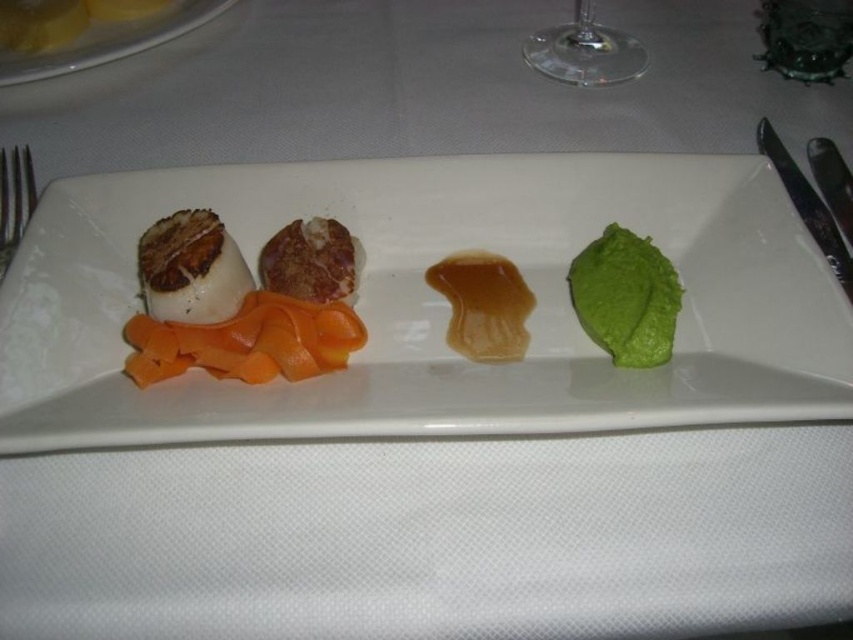
Does point (171, 20) come farther from viewer compared to point (543, 38)?

Yes, point (171, 20) is farther from viewer.

This screenshot has width=853, height=640. What do you see at coordinates (109, 42) in the screenshot?
I see `yellow matte plate at upper left` at bounding box center [109, 42].

Find the location of a particular element. This screenshot has width=853, height=640. yellow matte plate at upper left is located at coordinates (109, 42).

This screenshot has height=640, width=853. Describe the element at coordinates (584, 51) in the screenshot. I see `transparent glass wine glass at upper center` at that location.

Is transparent glass wine glass at upper center to the right of silvermetallicutensil at right from the viewer's perspective?

No, transparent glass wine glass at upper center is not to the right of silvermetallicutensil at right.

Between point (614, 74) and point (814, 240), which one is positioned behind?

Point (614, 74)

At what (x,y) coordinates should I click in order to perform the action: click on transparent glass wine glass at upper center. Please return your answer as a coordinate pair (x, y). The width and height of the screenshot is (853, 640). Looking at the image, I should click on (584, 51).

This screenshot has width=853, height=640. Describe the element at coordinates (311, 260) in the screenshot. I see `brown crispy meat at center` at that location.

In the scene shown: Which is more to the right, brown crispy meat at center or yellow matte plate at upper left?

From the viewer's perspective, brown crispy meat at center appears more on the right side.

Does point (340, 278) come closer to viewer compared to point (209, 1)?

Yes, it is in front of point (209, 1).

Image resolution: width=853 pixels, height=640 pixels. I want to click on brown crispy meat at center, so click(311, 260).